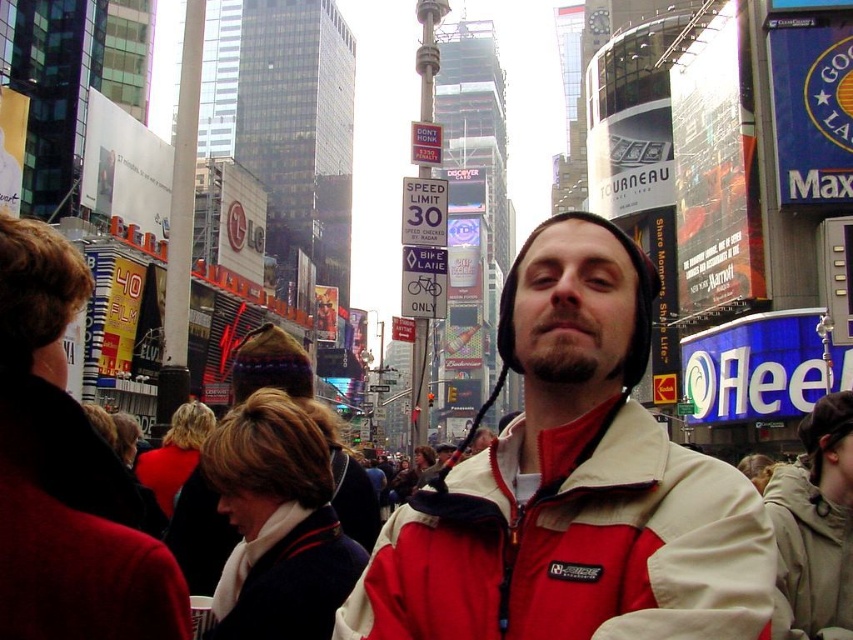
Question: Does red and white jacket at center appear on the right side of light gray fleece jacket at lower right?

Choices:
 (A) no
 (B) yes

Answer: (A)

Question: Is red and white jacket at center positioned in front of light gray fleece jacket at lower right?

Choices:
 (A) yes
 (B) no

Answer: (A)

Question: Which point is closer to the camera?

Choices:
 (A) red and white jacket at center
 (B) light gray fleece jacket at lower right

Answer: (A)

Question: Can you confirm if red and white jacket at center is thinner than light gray fleece jacket at lower right?

Choices:
 (A) yes
 (B) no

Answer: (B)

Question: Which point is closer to the camera?

Choices:
 (A) (816, 518)
 (B) (659, 493)

Answer: (B)